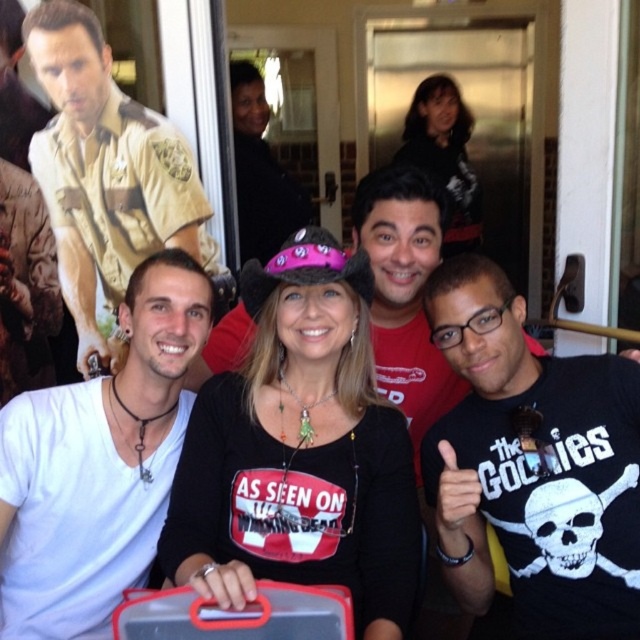
Consider the image. Measure the distance between white matte shirt at center and camera.

white matte shirt at center is 1.36 meters from camera.

Who is more distant from viewer, (168, 442) or (44, 60)?

The point (44, 60) is behind.

From the picture: Who is more distant from viewer, (138, 419) or (109, 92)?

The point (109, 92) is behind.

At what (x,y) coordinates should I click in order to perform the action: click on white matte shirt at center. Please return your answer as a coordinate pair (x, y). The image size is (640, 640). Looking at the image, I should click on (99, 464).

Describe the element at coordinates (99, 464) in the screenshot. Image resolution: width=640 pixels, height=640 pixels. I see `white matte shirt at center` at that location.

Is point (58, 609) less distant than point (417, 358)?

Yes, it is.

Find the location of a particular element. white matte shirt at center is located at coordinates click(99, 464).

What are the coordinates of `white matte shirt at center` in the screenshot? It's located at (99, 464).

Is pink fabric hat at center shorter than white matte shirt at center?

Incorrect, pink fabric hat at center's height does not fall short of white matte shirt at center's.

What do you see at coordinates (300, 451) in the screenshot? Image resolution: width=640 pixels, height=640 pixels. I see `pink fabric hat at center` at bounding box center [300, 451].

At what (x,y) coordinates should I click in order to perform the action: click on pink fabric hat at center. Please return your answer as a coordinate pair (x, y). The image size is (640, 640). Looking at the image, I should click on (300, 451).